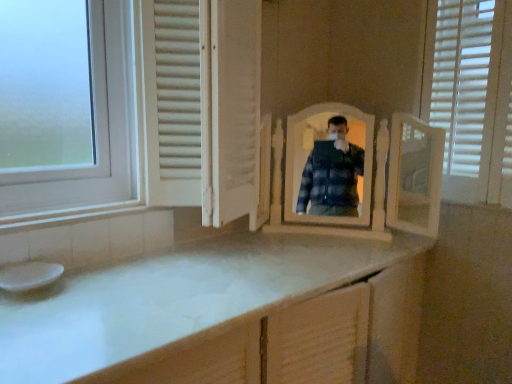
Question: Would you say white glossy sink at lower left is outside white wooden mirror at center?

Choices:
 (A) yes
 (B) no

Answer: (A)

Question: Is white glossy sink at lower left smaller than white wooden mirror at center?

Choices:
 (A) yes
 (B) no

Answer: (A)

Question: Is white glossy sink at lower left closer to the viewer compared to white wooden mirror at center?

Choices:
 (A) yes
 (B) no

Answer: (A)

Question: Is white glossy sink at lower left shorter than white wooden mirror at center?

Choices:
 (A) no
 (B) yes

Answer: (B)

Question: Are white glossy sink at lower left and white wooden mirror at center located far from each other?

Choices:
 (A) no
 (B) yes

Answer: (B)

Question: Relative to white matte screen door at center, is white glossy sink at lower left in front or behind?

Choices:
 (A) behind
 (B) front

Answer: (A)

Question: Visually, is white glossy sink at lower left positioned to the left or to the right of white matte screen door at center?

Choices:
 (A) right
 (B) left

Answer: (B)

Question: Is white glossy sink at lower left wider or thinner than white matte screen door at center?

Choices:
 (A) wide
 (B) thin

Answer: (B)

Question: Is point (26, 276) closer or farther from the camera than point (233, 170)?

Choices:
 (A) closer
 (B) farther

Answer: (A)

Question: Is white wooden mirror at center in front of or behind white matte screen door at center in the image?

Choices:
 (A) behind
 (B) front

Answer: (A)

Question: From the image's perspective, relative to white matte screen door at center, is white wooden mirror at center above or below?

Choices:
 (A) below
 (B) above

Answer: (A)

Question: Considering the relative positions of white wooden mirror at center and white matte screen door at center in the image provided, is white wooden mirror at center to the left or to the right of white matte screen door at center?

Choices:
 (A) left
 (B) right

Answer: (B)

Question: From their relative heights in the image, would you say white wooden mirror at center is taller or shorter than white matte screen door at center?

Choices:
 (A) short
 (B) tall

Answer: (A)

Question: From the image's perspective, is white matte screen door at center above or below white glossy sink at lower left?

Choices:
 (A) below
 (B) above

Answer: (B)

Question: Looking at the image, does white matte screen door at center seem bigger or smaller compared to white glossy sink at lower left?

Choices:
 (A) small
 (B) big

Answer: (B)